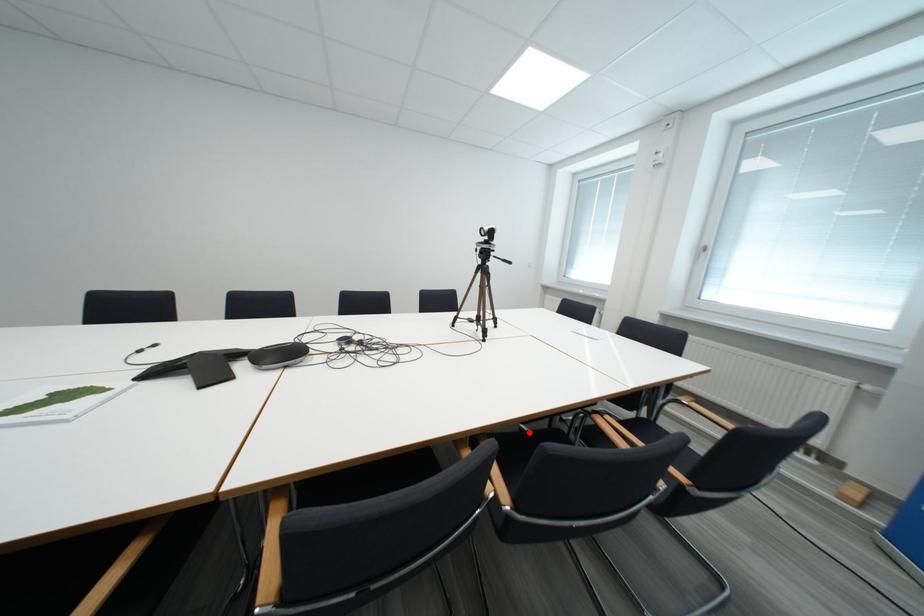
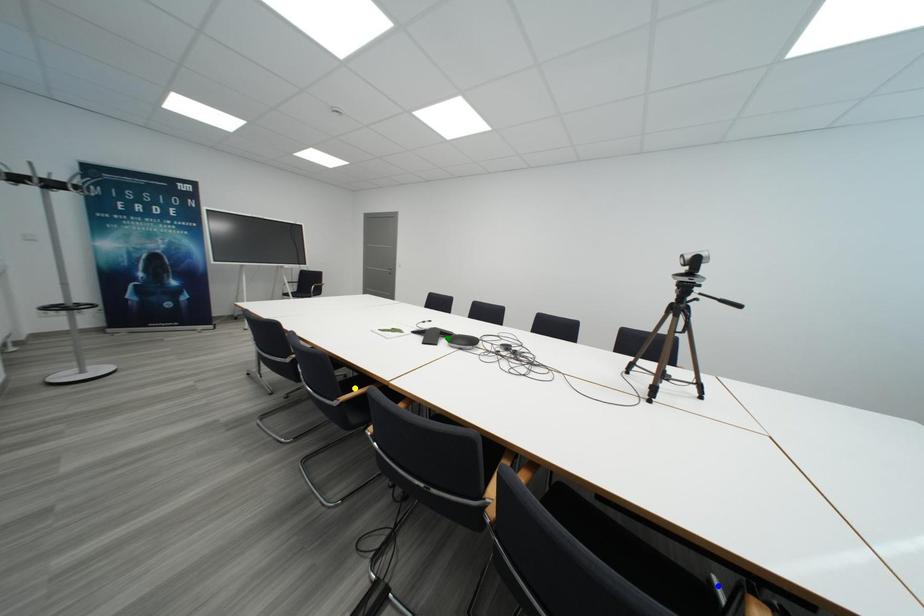
Question: I am providing you with two images of the same scene from different viewpoints. A red point is marked on the first image. You are given multiple points on the second image. Which spot in image 2 lines up with the point in image 1?

Choices:
 (A) yellow point
 (B) green point
 (C) blue point

Answer: (C)